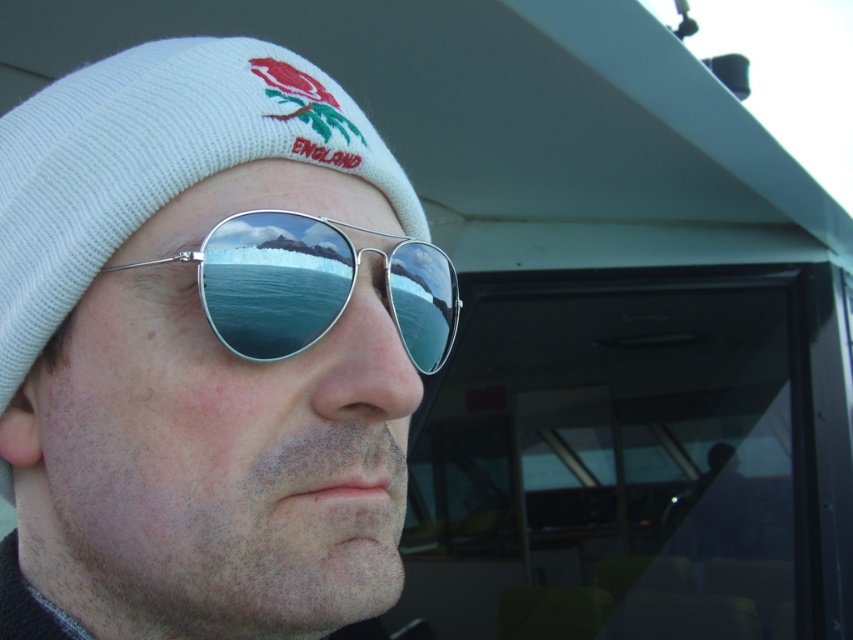
Which is below, white knit beanie at upper left or silver reflective aviator sunglasses at center?

white knit beanie at upper left

This screenshot has height=640, width=853. What do you see at coordinates (206, 349) in the screenshot?
I see `white knit beanie at upper left` at bounding box center [206, 349].

The height and width of the screenshot is (640, 853). What do you see at coordinates (206, 349) in the screenshot? I see `white knit beanie at upper left` at bounding box center [206, 349].

I want to click on white knit beanie at upper left, so click(x=206, y=349).